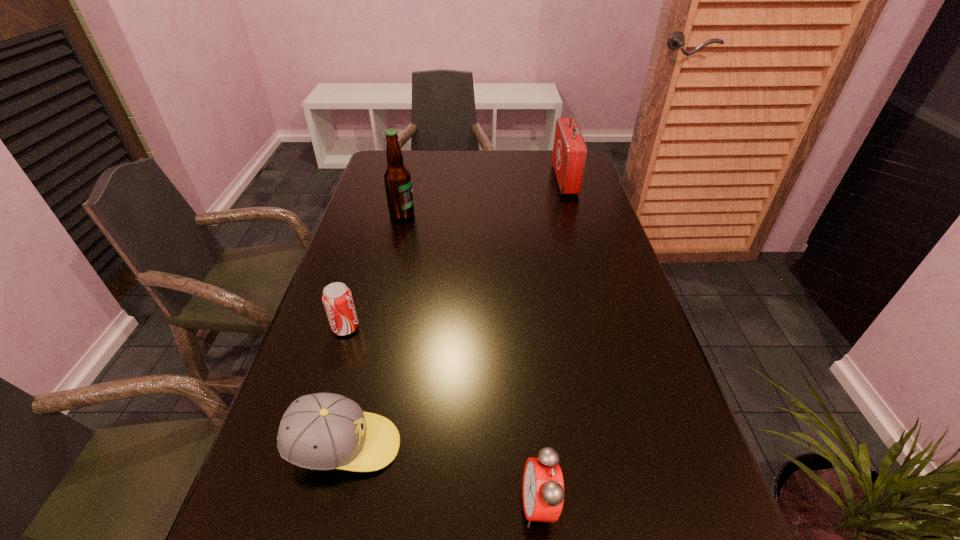
At what (x,y) coordinates should I click in order to perform the action: click on free space located on the side of the farthest object with the first aid cross symbol. Please return your answer as a coordinate pair (x, y). Looking at the image, I should click on (463, 179).

At what (x,y) coordinates should I click in order to perform the action: click on free space located on the logo side of the soda can. Please return your answer as a coordinate pair (x, y). The width and height of the screenshot is (960, 540). Looking at the image, I should click on (470, 328).

Image resolution: width=960 pixels, height=540 pixels. Identify the location of vacant space situated on the front-facing side of the fourth object from left to right. (335, 505).

Locate an element on the screen. Image resolution: width=960 pixels, height=540 pixels. vacant space located 0.240m on the front-facing side of the fourth object from left to right is located at coordinates (377, 505).

Where is `vacant area located 0.140m on the front-facing side of the fourth object from left to right`? The height and width of the screenshot is (540, 960). vacant area located 0.140m on the front-facing side of the fourth object from left to right is located at coordinates (438, 505).

Find the location of a particular element. The width and height of the screenshot is (960, 540). free space located 0.220m on the front-facing side of the baseball cap is located at coordinates (520, 446).

You are a GUI agent. You are given a task and a screenshot of the screen. Output one action in this format:
    pyautogui.click(x=<x>, y=<y>)
    Task: Click on the object at the far edge
    
    Given the screenshot: What is the action you would take?
    pyautogui.click(x=569, y=155)

Locate an element on the screen. The width and height of the screenshot is (960, 540). beer bottle that is at the left edge is located at coordinates (397, 179).

Where is `soda can positioned at the left edge`? The width and height of the screenshot is (960, 540). soda can positioned at the left edge is located at coordinates (337, 299).

Find the location of `baseball cap present at the left edge`. baseball cap present at the left edge is located at coordinates click(323, 431).